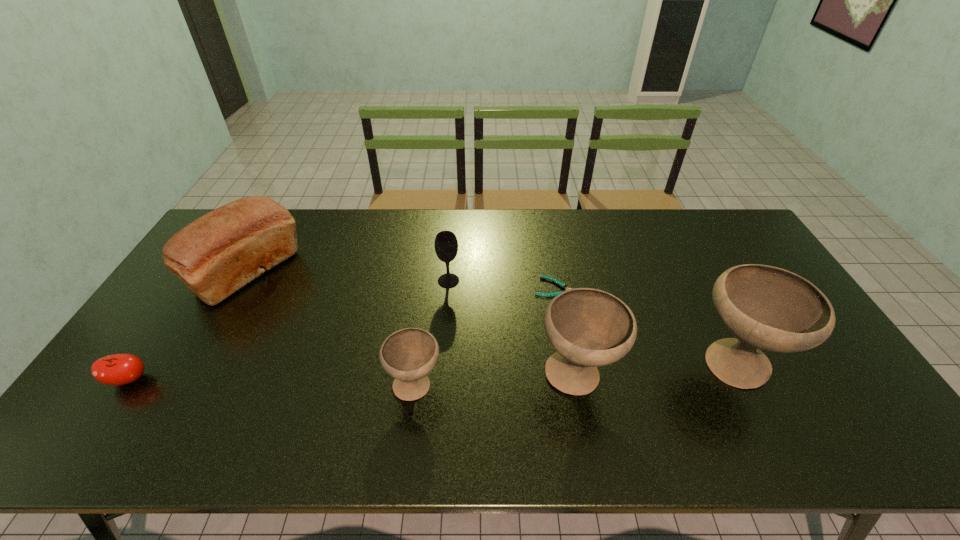
With all chalices evenly spaced, where should an extra chalice be placed on the left to continue the pattern? Please point out a vacant space. Please provide its 2D coordinates. Your answer should be formatted as a tuple, i.e. [(x, y)], where the tuple contains the x and y coordinates of a point satisfying the conditions above.

[(247, 396)]